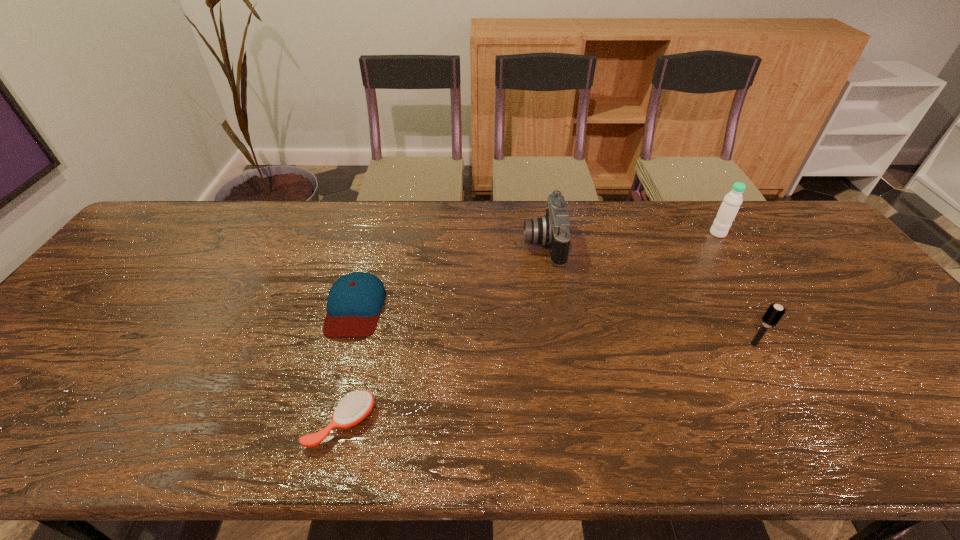
The image size is (960, 540). In order to click on water bottle in this screenshot , I will do (x=728, y=210).

This screenshot has height=540, width=960. What are the coordinates of `the rightmost object` in the screenshot? It's located at (728, 210).

Find the location of a particular element. This screenshot has height=540, width=960. the third object from right to left is located at coordinates (553, 230).

At what (x,y) coordinates should I click in order to perform the action: click on the right hairbrush. Please return your answer as a coordinate pair (x, y). This screenshot has width=960, height=540. Looking at the image, I should click on (774, 313).

You are a GUI agent. You are given a task and a screenshot of the screen. Output one action in this format:
    pyautogui.click(x=<x>, y=<y>)
    Task: Click on the taller hairbrush
    
    Given the screenshot: What is the action you would take?
    pyautogui.click(x=774, y=313)

At what (x,y) coordinates should I click in order to perform the action: click on baseball cap. Please return your answer as a coordinate pair (x, y). Looking at the image, I should click on (354, 302).

The height and width of the screenshot is (540, 960). Identify the location of the shorter hairbrush. (356, 406).

This screenshot has width=960, height=540. Identify the location of the shortest object. (356, 406).

You are a GUI agent. You are given a task and a screenshot of the screen. Output one action in this format:
    pyautogui.click(x=<x>, y=<y>)
    Task: Click on the free space located on the right of the tallest object
    The image size is (960, 540).
    Given the screenshot: What is the action you would take?
    pyautogui.click(x=760, y=233)

This screenshot has height=540, width=960. Identify the location of free location located 0.180m on the front-facing side of the camera. (465, 244).